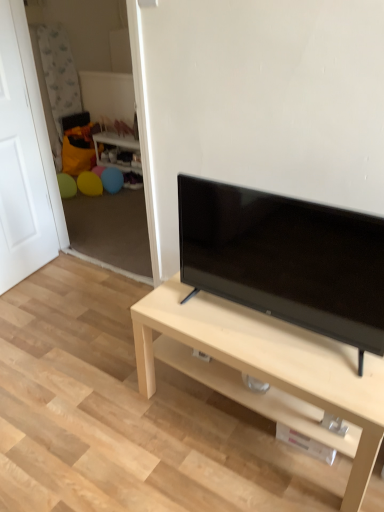
At what (x,y) coordinates should I click in order to perform the action: click on free region on the left part of light wood/finish tv stand at center. Please return your answer as a coordinate pair (x, y). Looking at the image, I should click on (123, 437).